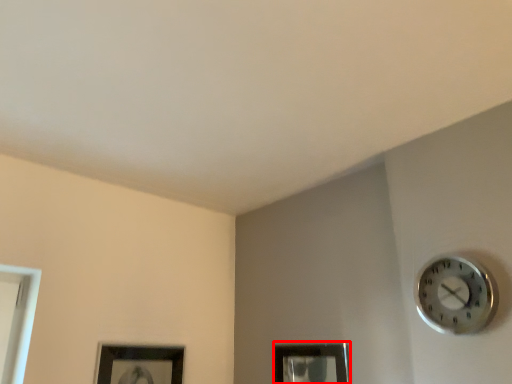
Question: In this image, where is picture frame (annotated by the red box) located relative to wall clock?

Choices:
 (A) right
 (B) left

Answer: (B)